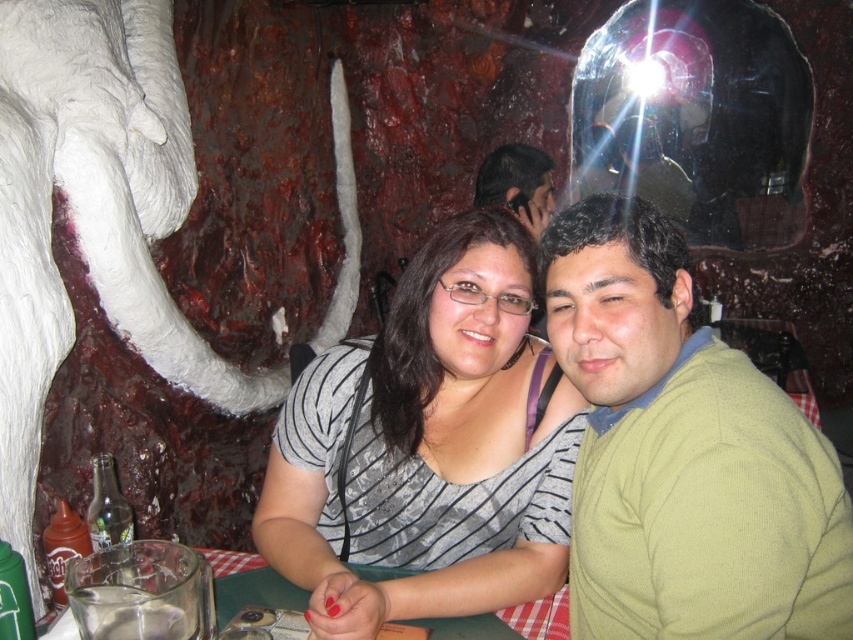
Does point (579, 205) come behind point (527, 256)?

That is False.

Does green sweater at center have a smaller size compared to gray striped shirt at center?

Yes, green sweater at center is smaller than gray striped shirt at center.

I want to click on green sweater at center, so click(x=683, y=452).

This screenshot has height=640, width=853. What are the coordinates of `green sweater at center` in the screenshot? It's located at (683, 452).

Does green sweater at center have a lesser width compared to matte green sweater at center?

No, green sweater at center is not thinner than matte green sweater at center.

Measure the distance between green sweater at center and matte green sweater at center.

They are 5.39 feet apart.

Locate an element on the screen. The image size is (853, 640). green sweater at center is located at coordinates click(683, 452).

Can you confirm if gray striped shirt at center is shorter than matte green sweater at center?

No, gray striped shirt at center is not shorter than matte green sweater at center.

Is point (550, 509) less distant than point (540, 220)?

Yes, point (550, 509) is in front of point (540, 220).

Locate an element on the screen. The image size is (853, 640). gray striped shirt at center is located at coordinates (427, 449).

This screenshot has height=640, width=853. Find the location of `gray striped shirt at center`. gray striped shirt at center is located at coordinates (427, 449).